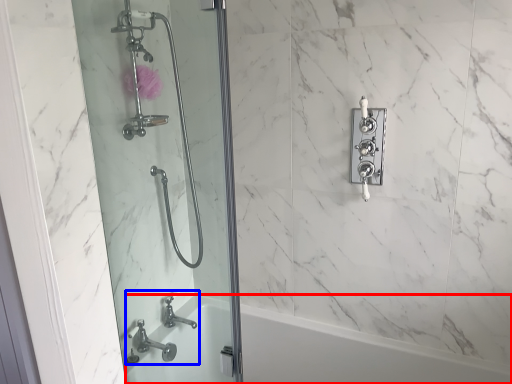
Question: Which point is further to the camera, bath (highlighted by a red box) or sink (highlighted by a blue box)?

Choices:
 (A) bath
 (B) sink

Answer: (B)